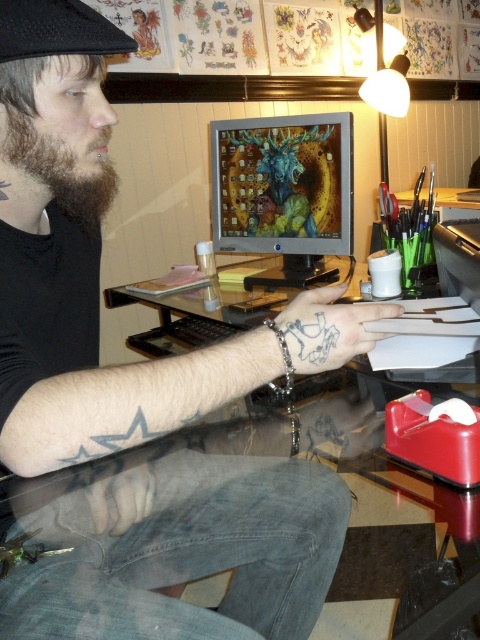
Looking at this image, is blue ink tattoo at upper center thinner than black ink star at lower left?

Incorrect, blue ink tattoo at upper center's width is not less than black ink star at lower left's.

Between blue ink tattoo at upper center and black ink star at lower left, which one is positioned lower?

blue ink tattoo at upper center is lower down.

Locate an element on the screen. This screenshot has height=640, width=480. blue ink tattoo at upper center is located at coordinates (312, 339).

Can you confirm if brown fuzzy beard at left is bigger than black fabric baseball hat at upper left?

Indeed, brown fuzzy beard at left has a larger size compared to black fabric baseball hat at upper left.

Does brown fuzzy beard at left come behind black fabric baseball hat at upper left?

Yes.

Between point (107, 200) and point (32, 51), which one is positioned behind?

Point (107, 200)

You are a GUI agent. You are given a task and a screenshot of the screen. Output one action in this format:
    pyautogui.click(x=<x>, y=<y>)
    Task: Click on the brown fuzzy beard at left
    The height and width of the screenshot is (640, 480).
    Given the screenshot: What is the action you would take?
    pyautogui.click(x=55, y=168)

Is the position of black fabric baseball hat at upper left less distant than that of blue ink tattoo at upper center?

Yes, black fabric baseball hat at upper left is closer to the viewer.

From the picture: Does black fabric baseball hat at upper left have a smaller size compared to blue ink tattoo at upper center?

No, black fabric baseball hat at upper left is not smaller than blue ink tattoo at upper center.

The width and height of the screenshot is (480, 640). What do you see at coordinates (57, 29) in the screenshot? I see `black fabric baseball hat at upper left` at bounding box center [57, 29].

This screenshot has width=480, height=640. I want to click on black fabric baseball hat at upper left, so click(57, 29).